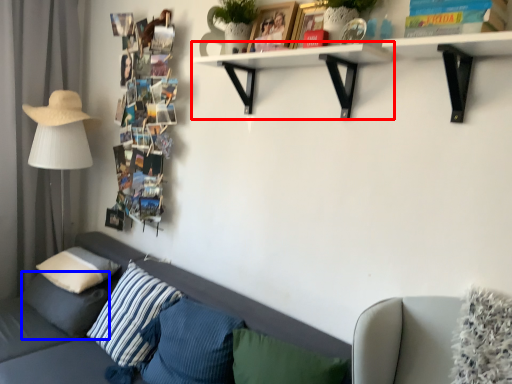
Question: Which object is further to the camera taking this photo, shelf (highlighted by a red box) or pillow (highlighted by a blue box)?

Choices:
 (A) shelf
 (B) pillow

Answer: (B)